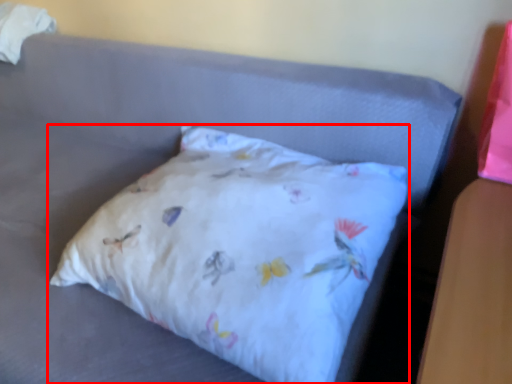
Question: From the image's perspective, what is the correct spatial positioning of pillow (annotated by the red box) in reference to material?

Choices:
 (A) above
 (B) below

Answer: (B)